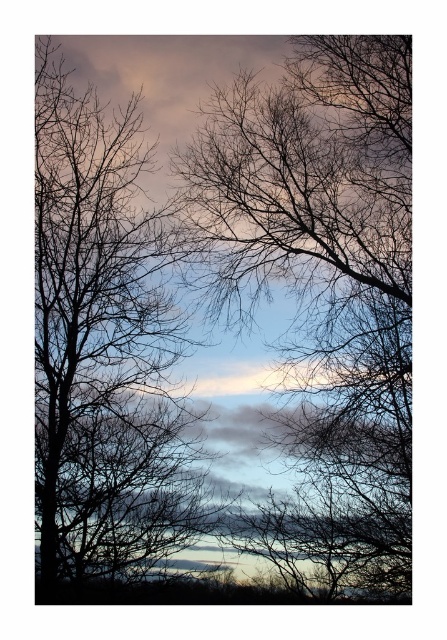
You are an artist sketching the scene and want to ensure the proportions are accurate. Given the silhouette branches at center and the silhouette bare tree at left, which one should you draw taller in your sketch?

The silhouette bare tree at left should be drawn taller than the silhouette branches at center because the silhouette branches at center has a lesser height compared to silhouette bare tree at left.

Based on the coordinates provided in the description, where is the silhouette branches at center located in the image?

The silhouette branches at center are located at point coordinates of (320, 291).